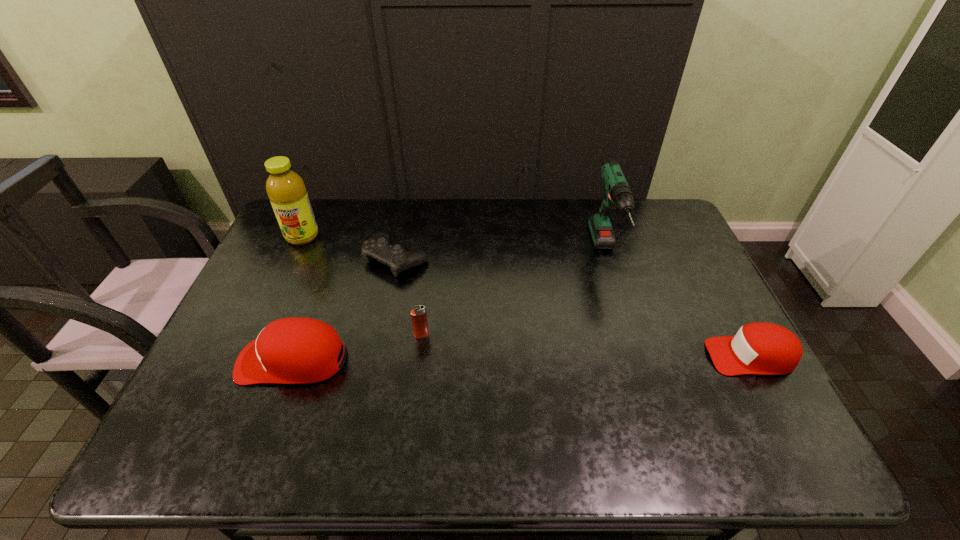
I want to click on vacant area between the shortest object and the drill, so click(x=501, y=256).

This screenshot has width=960, height=540. What are the coordinates of `free space between the control and the igniter` in the screenshot? It's located at (x=409, y=297).

Find the location of `vacant area that lies between the control and the fruit juice`. vacant area that lies between the control and the fruit juice is located at coordinates (349, 247).

The image size is (960, 540). Identify the location of vacant space that is in between the right baseball cap and the shortest object. (573, 307).

You are a GUI agent. You are given a task and a screenshot of the screen. Output one action in this format:
    pyautogui.click(x=<x>, y=<y>)
    Task: Click on the free point between the fruit juice and the igniter
    
    Given the screenshot: What is the action you would take?
    pyautogui.click(x=362, y=286)

Locate an element on the screen. free space between the second object from right to left and the shortest object is located at coordinates (501, 256).

Where is `free spot between the fruit juice and the fifth tallest object`? This screenshot has height=540, width=960. free spot between the fruit juice and the fifth tallest object is located at coordinates (526, 296).

Point out which object is positioned as the fifth nearest to the rightmost object. Please provide its 2D coordinates. Your answer should be formatted as a tuple, i.e. [(x, y)], where the tuple contains the x and y coordinates of a point satisfying the conditions above.

[(286, 190)]

The width and height of the screenshot is (960, 540). I want to click on object that stands as the fifth closest to the control, so click(x=761, y=348).

Where is `free space that satisfies the following two spatial constraints: 1. on the front label of the shortest object; 2. on the right side of the fruit juice`? The width and height of the screenshot is (960, 540). free space that satisfies the following two spatial constraints: 1. on the front label of the shortest object; 2. on the right side of the fruit juice is located at coordinates (292, 259).